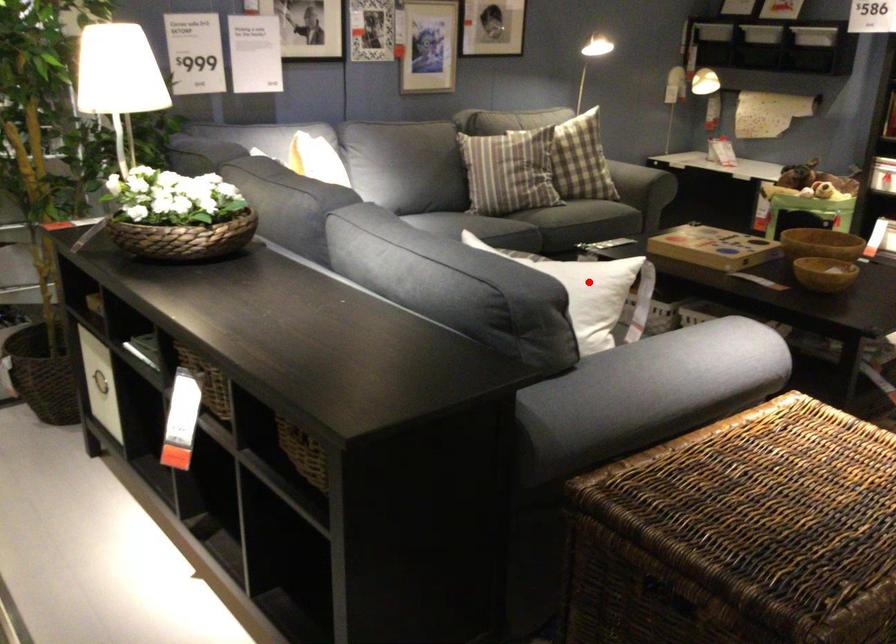
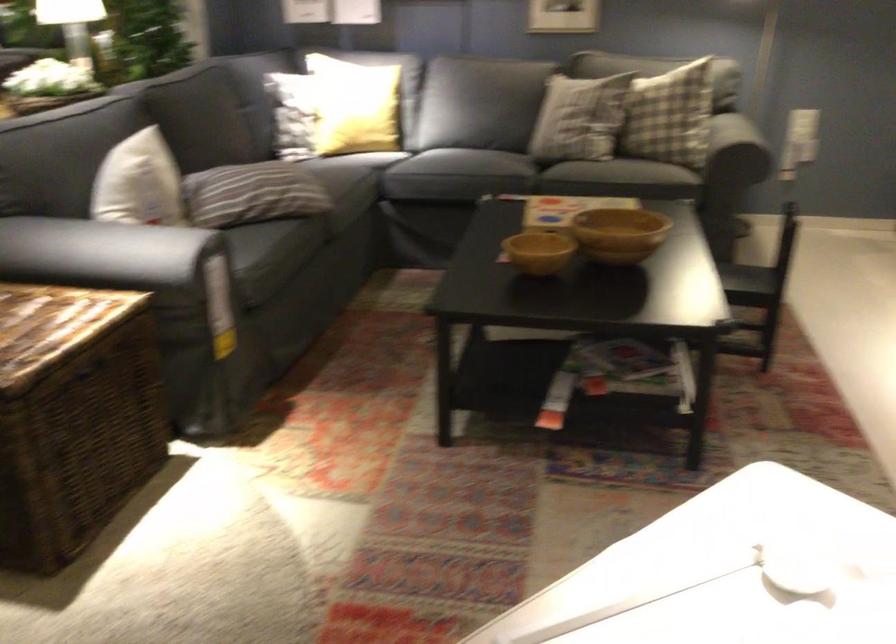
Question: I am providing you with two images of the same scene from different viewpoints. Given a red point in image1, look at the same physical point in image2. Is it:

Choices:
 (A) Closer to the viewpoint
 (B) Farther from the viewpoint

Answer: (B)